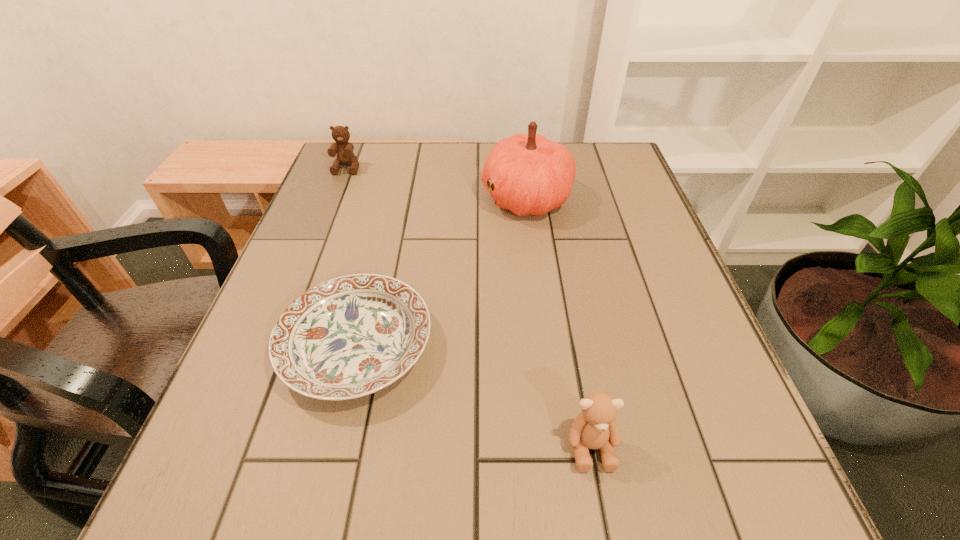
At what (x,y) coordinates should I click in order to perform the action: click on pumpkin. Please return your answer as a coordinate pair (x, y). This screenshot has width=960, height=540. Looking at the image, I should click on (532, 175).

Where is `the left teddy bear`? Image resolution: width=960 pixels, height=540 pixels. the left teddy bear is located at coordinates (345, 156).

Where is `the right teddy bear`? The height and width of the screenshot is (540, 960). the right teddy bear is located at coordinates (595, 428).

Find the location of `the nearest object`. the nearest object is located at coordinates (595, 428).

Find the location of a particular element. plate is located at coordinates (351, 336).

Where is `the second nearest object`? the second nearest object is located at coordinates (351, 336).

Where is `vacant space located 0.110m on the front-facing side of the pumpkin`? Image resolution: width=960 pixels, height=540 pixels. vacant space located 0.110m on the front-facing side of the pumpkin is located at coordinates (x=438, y=198).

Locate an element on the screen. free space located 0.250m on the front-facing side of the pumpkin is located at coordinates (382, 198).

Identify the location of free space located on the front-facing side of the pumpkin. The image size is (960, 540). (371, 198).

Where is `vacant space located 0.110m on the face of the left teddy bear`? This screenshot has height=540, width=960. vacant space located 0.110m on the face of the left teddy bear is located at coordinates (334, 199).